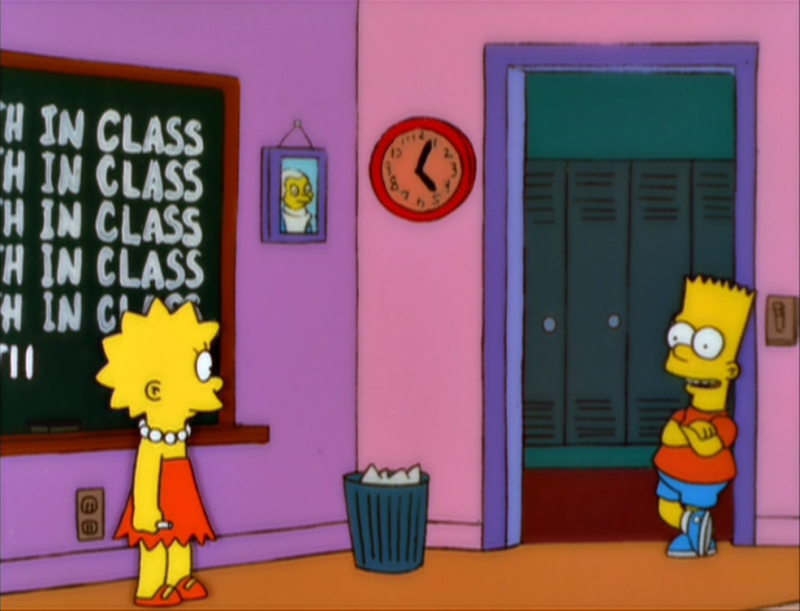
In order to click on locker in this screenshot , I will do `click(624, 262)`.